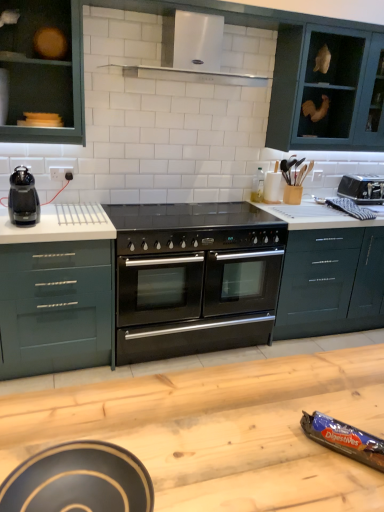
The height and width of the screenshot is (512, 384). I want to click on vacant area situated to the left side of blue foil digestives at lower right, which is counted as the 2th appliance, starting from the top, so click(x=287, y=447).